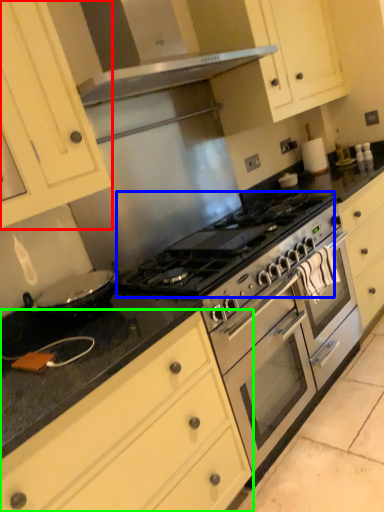
Question: Based on their relative distances, which object is nearer to cabinetry (highlighted by a red box)? Choose from gas stove (highlighted by a blue box) and cabinetry (highlighted by a green box).

Choices:
 (A) gas stove
 (B) cabinetry

Answer: (A)